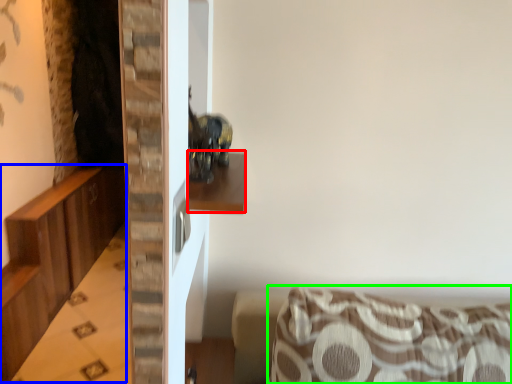
Question: Which object is the closest to the shelf (highlighted by a red box)? Choose among these: dresser (highlighted by a blue box) or furniture (highlighted by a green box).

Choices:
 (A) dresser
 (B) furniture

Answer: (B)